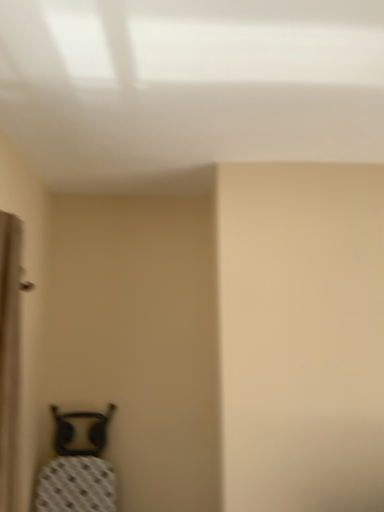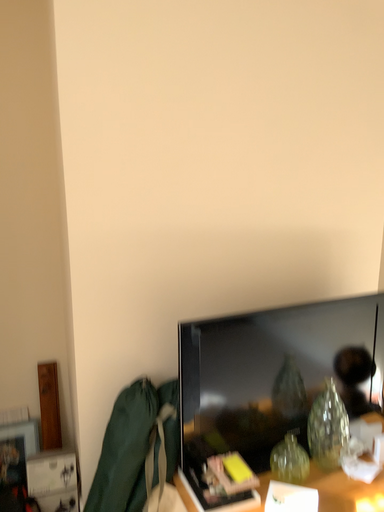
Question: How did the camera likely rotate when shooting the video?

Choices:
 (A) rotated upward
 (B) rotated downward

Answer: (B)